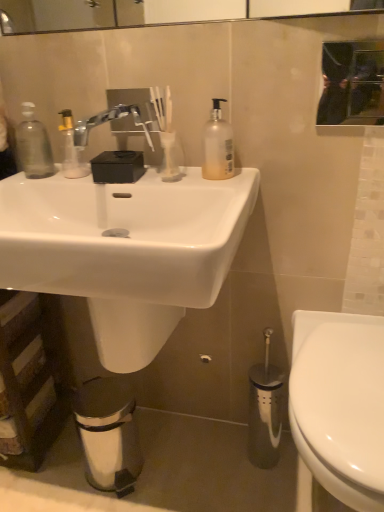
What do you see at coordinates (33, 145) in the screenshot?
I see `transparent plastic soap dispenser at left` at bounding box center [33, 145].

What do you see at coordinates (340, 403) in the screenshot? The width and height of the screenshot is (384, 512). I see `white glossy toilet at lower right` at bounding box center [340, 403].

Locate an element on the screen. This screenshot has height=512, width=384. white glossy sink at center is located at coordinates (125, 250).

What is the approximate width of white glossy sink at center?

It is 18.63 inches.

Where is `transparent plastic soap dispenser at left`? This screenshot has height=512, width=384. transparent plastic soap dispenser at left is located at coordinates point(33,145).

Which object is closer to the camera taking this photo, transparent plastic soap dispenser at left or white glossy sink at center?

white glossy sink at center is more forward.

Who is smaller, transparent plastic soap dispenser at left or white glossy sink at center?

transparent plastic soap dispenser at left is smaller.

Which of these two, transparent plastic soap dispenser at left or white glossy sink at center, is wider?

white glossy sink at center.

From the image's perspective, is black glass mirror at upper center located beneath white glossy toilet at lower right?

Actually, black glass mirror at upper center appears above white glossy toilet at lower right in the image.

Which object is further away from the camera, black glass mirror at upper center or white glossy toilet at lower right?

black glass mirror at upper center is more distant.

Looking at this image, is black glass mirror at upper center bigger or smaller than white glossy toilet at lower right?

black glass mirror at upper center is smaller than white glossy toilet at lower right.

Who is taller, black glass mirror at upper center or white glossy toilet at lower right?

With more height is white glossy toilet at lower right.

Considering the relative positions of white glossy sink at center and black glass mirror at upper center in the image provided, is white glossy sink at center behind black glass mirror at upper center?

No, it is in front of black glass mirror at upper center.

Identify the location of sink on the left of the black glass mirror at upper center. This screenshot has width=384, height=512. (125, 250).

From a real-world perspective, is white glossy sink at center positioned over black glass mirror at upper center based on gravity?

→ No, from a real-world perspective, white glossy sink at center is not over black glass mirror at upper center

Choose the correct answer: Is satin nickel faucet at upper center inside transparent plastic soap dispenser at left or outside it?

satin nickel faucet at upper center is not enclosed by transparent plastic soap dispenser at left.

Which point is more distant from viewer, (154, 130) or (32, 174)?

The point (32, 174) is behind.

Does satin nickel faucet at upper center have a lesser width compared to transparent plastic soap dispenser at left?

No.

From the image's perspective, does satin nickel faucet at upper center appear lower than transparent plastic soap dispenser at left?

No.

Is point (321, 401) farther from camera compared to point (214, 146)?

No.

Between white glossy toilet at lower right and translucent plastic pump bottle at upper center, which one has larger size?

With larger size is white glossy toilet at lower right.

Considering the positions of objects white glossy toilet at lower right and translucent plastic pump bottle at upper center in the image provided, who is more to the left, white glossy toilet at lower right or translucent plastic pump bottle at upper center?

translucent plastic pump bottle at upper center.

Considering the sizes of white glossy toilet at lower right and translucent plastic pump bottle at upper center in the image, is white glossy toilet at lower right wider or thinner than translucent plastic pump bottle at upper center?

Considering their sizes, white glossy toilet at lower right looks broader than translucent plastic pump bottle at upper center.

From the picture: Would you say white glossy toilet at lower right is inside or outside satin nickel faucet at upper center?

white glossy toilet at lower right is spatially situated outside satin nickel faucet at upper center.

Is white glossy toilet at lower right far away from satin nickel faucet at upper center?

No, white glossy toilet at lower right is not far away from satin nickel faucet at upper center.

Is white glossy toilet at lower right positioned in front of satin nickel faucet at upper center?

Yes, it is.

In the image, is white glossy toilet at lower right on the left side or the right side of satin nickel faucet at upper center?

Based on their positions, white glossy toilet at lower right is located to the right of satin nickel faucet at upper center.

Does black glass mirror at upper center have a greater width compared to satin nickel faucet at upper center?

In fact, black glass mirror at upper center might be narrower than satin nickel faucet at upper center.

Is black glass mirror at upper center located outside satin nickel faucet at upper center?

Absolutely, black glass mirror at upper center is external to satin nickel faucet at upper center.

From the image's perspective, is black glass mirror at upper center beneath satin nickel faucet at upper center?

No.

Considering the sizes of objects black glass mirror at upper center and satin nickel faucet at upper center in the image provided, who is shorter, black glass mirror at upper center or satin nickel faucet at upper center?

satin nickel faucet at upper center is shorter.

Locate an element on the screen. This screenshot has height=512, width=384. bottle that is above the white glossy sink at center (from the image's perspective) is located at coordinates (33, 145).

Find the location of a particular element. Image resolution: width=384 pixels, height=512 pixels. mirror on the right of white glossy toilet at lower right is located at coordinates (352, 83).

Estimate the real-world distances between objects in this image. Which object is closer to satin nickel faucet at upper center, white glossy toilet at lower right or translucent plastic pump bottle at upper center?

translucent plastic pump bottle at upper center.

Looking at the image, which one is located closer to black glass mirror at upper center, white glossy toilet at lower right or transparent plastic soap dispenser at left?

white glossy toilet at lower right is positioned closer to the anchor black glass mirror at upper center.

When comparing their distances from transparent plastic soap dispenser at left, does white glossy sink at center or translucent plastic pump bottle at upper center seem closer?

white glossy sink at center.

Looking at the image, which one is located closer to white glossy sink at center, black glass mirror at upper center or transparent plastic soap dispenser at left?

transparent plastic soap dispenser at left lies closer to white glossy sink at center than the other object.

Looking at the image, which one is located closer to white glossy sink at center, translucent plastic pump bottle at upper center or white glossy toilet at lower right?

translucent plastic pump bottle at upper center is closer to white glossy sink at center.

Based on their spatial positions, is white glossy toilet at lower right or translucent plastic pump bottle at upper center further from black glass mirror at upper center?

white glossy toilet at lower right is further to black glass mirror at upper center.

From the image, which object appears to be farther from satin nickel faucet at upper center, translucent plastic pump bottle at upper center or white glossy toilet at lower right?

Among the two, white glossy toilet at lower right is located further to satin nickel faucet at upper center.

Estimate the real-world distances between objects in this image. Which object is closer to white glossy sink at center, translucent plastic pump bottle at upper center or satin nickel faucet at upper center?

Among the two, translucent plastic pump bottle at upper center is located nearer to white glossy sink at center.

This screenshot has width=384, height=512. Identify the location of tap between transparent plastic soap dispenser at left and translucent plastic pump bottle at upper center. (113, 120).

I want to click on sink between translucent plastic pump bottle at upper center and white glossy toilet at lower right vertically, so (125, 250).

Find the location of `sink between transparent plastic soap dispenser at left and black glass mirror at upper center from left to right`. sink between transparent plastic soap dispenser at left and black glass mirror at upper center from left to right is located at coordinates coord(125,250).

This screenshot has width=384, height=512. Identify the location of toilet situated between transparent plastic soap dispenser at left and black glass mirror at upper center from left to right. (340, 403).